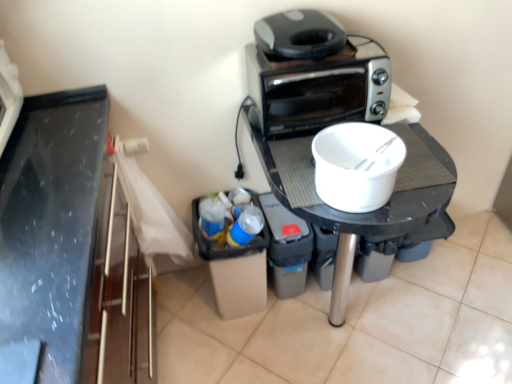
Question: Considering the relative positions of black plastic table at center and gray plastic toaster oven at upper right in the image provided, is black plastic table at center to the left of gray plastic toaster oven at upper right from the viewer's perspective?

Choices:
 (A) no
 (B) yes

Answer: (A)

Question: Is black plastic table at center far from gray plastic toaster oven at upper right?

Choices:
 (A) no
 (B) yes

Answer: (A)

Question: Is black plastic table at center closer to camera compared to gray plastic toaster oven at upper right?

Choices:
 (A) no
 (B) yes

Answer: (B)

Question: From the image's perspective, is black plastic table at center under gray plastic toaster oven at upper right?

Choices:
 (A) yes
 (B) no

Answer: (A)

Question: Would you say black plastic table at center contains gray plastic toaster oven at upper right?

Choices:
 (A) yes
 (B) no

Answer: (B)

Question: Considering the positions of point pos(324,119) and point pos(372,148), is point pos(324,119) closer or farther from the camera than point pos(372,148)?

Choices:
 (A) closer
 (B) farther

Answer: (B)

Question: Considering the positions of silver metallic toaster at upper center and white matte bowl at center in the image, is silver metallic toaster at upper center taller or shorter than white matte bowl at center?

Choices:
 (A) tall
 (B) short

Answer: (A)

Question: Is silver metallic toaster at upper center inside the boundaries of white matte bowl at center, or outside?

Choices:
 (A) inside
 (B) outside

Answer: (B)

Question: Considering the positions of silver metallic toaster at upper center and white matte bowl at center in the image, is silver metallic toaster at upper center wider or thinner than white matte bowl at center?

Choices:
 (A) wide
 (B) thin

Answer: (A)

Question: Is white matte bowl at center taller or shorter than black plastic table at center?

Choices:
 (A) short
 (B) tall

Answer: (A)

Question: From a real-world perspective, is white matte bowl at center above or below black plastic table at center?

Choices:
 (A) above
 (B) below

Answer: (A)

Question: Is white matte bowl at center inside the boundaries of black plastic table at center, or outside?

Choices:
 (A) inside
 (B) outside

Answer: (B)

Question: Considering their positions, is white matte bowl at center located in front of or behind black plastic table at center?

Choices:
 (A) front
 (B) behind

Answer: (A)

Question: Considering the positions of white matte bowl at center and silver metallic toaster at upper center in the image, is white matte bowl at center wider or thinner than silver metallic toaster at upper center?

Choices:
 (A) thin
 (B) wide

Answer: (A)

Question: Based on their positions, is white matte bowl at center located to the left or right of silver metallic toaster at upper center?

Choices:
 (A) right
 (B) left

Answer: (A)